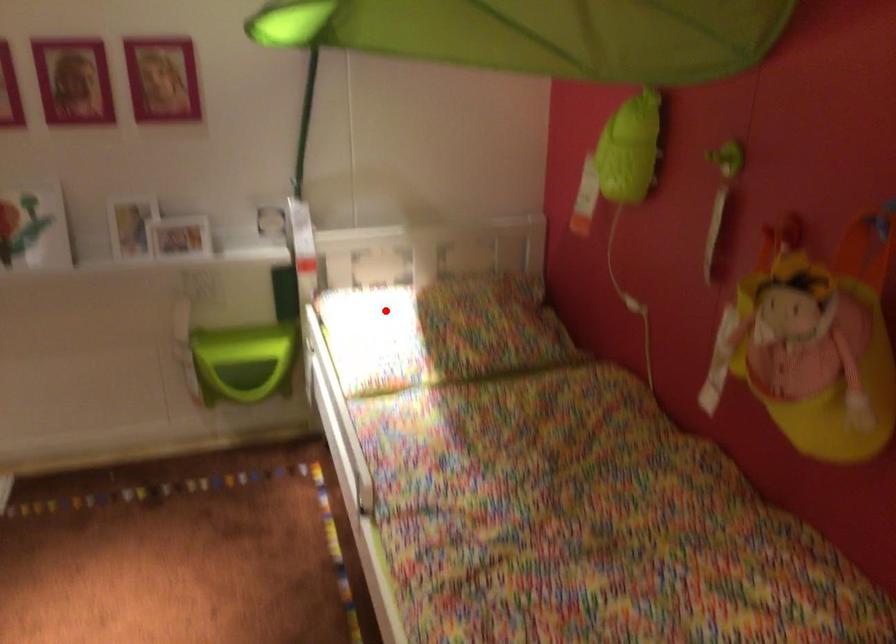
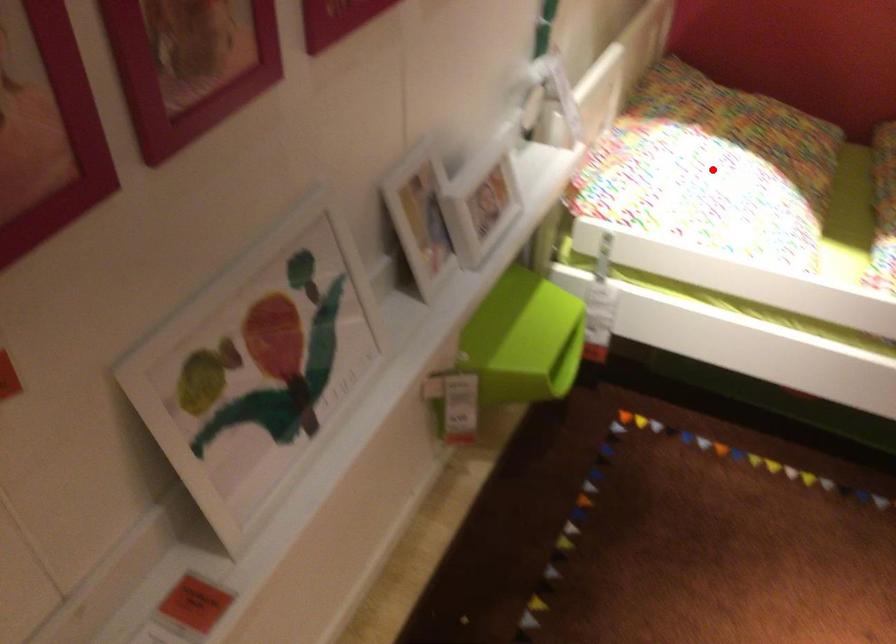
I am providing you with two images of the same scene from different viewpoints. A red point is marked on the first image and another point is marked on the second image. Is the red point in image1 aligned with the point shown in image2?

Yes